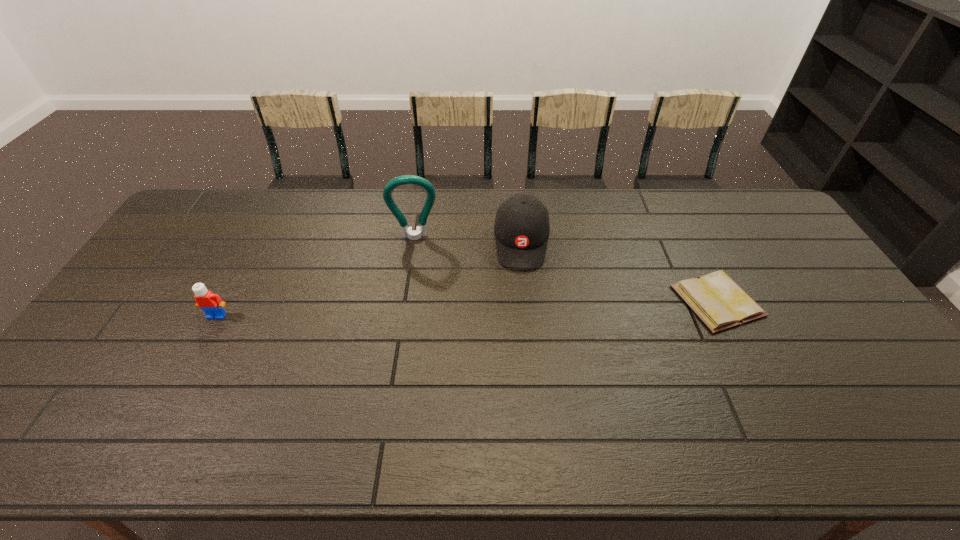
Where is `vacant space on the desktop that is between the leftmost object and the diary and is positioned at the jaws of the third object from right to left`? vacant space on the desktop that is between the leftmost object and the diary and is positioned at the jaws of the third object from right to left is located at coordinates (416, 309).

The height and width of the screenshot is (540, 960). In order to click on free space on the desktop that is between the leftmost object and the shortest object and is positioned with a logo on the front of the baseball cap in this screenshot , I will do pyautogui.click(x=521, y=307).